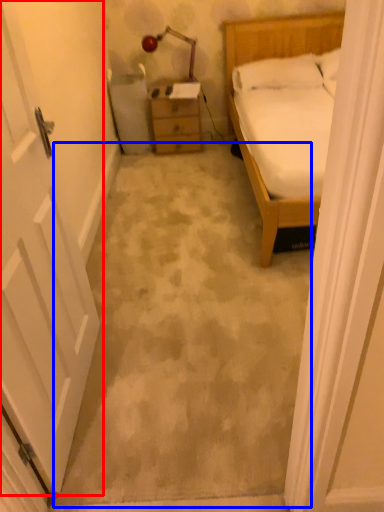
Question: Which point is further to the camera, door (highlighted by a red box) or concrete (highlighted by a blue box)?

Choices:
 (A) door
 (B) concrete

Answer: (B)